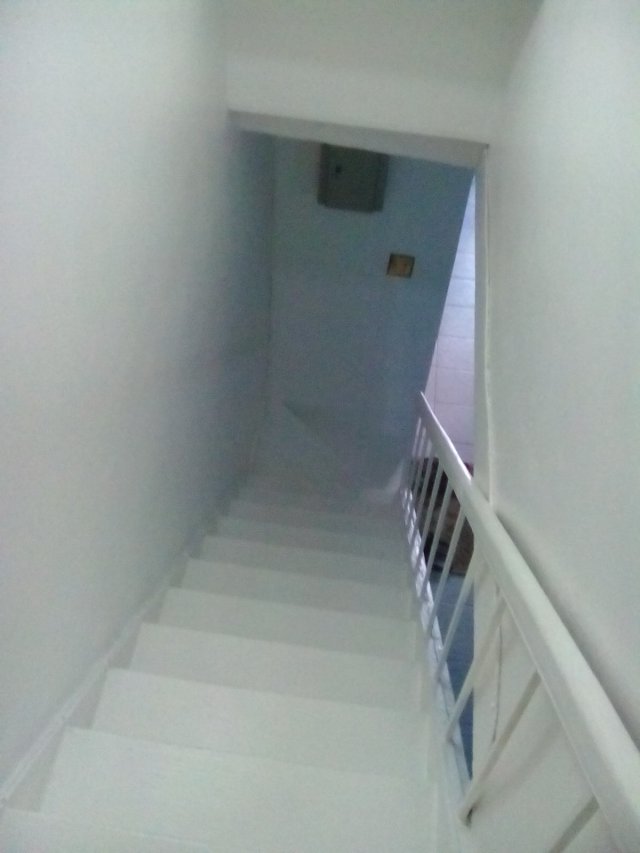
Find the location of a particular element. balustrades is located at coordinates (585, 811), (518, 700), (484, 636), (460, 601), (448, 558), (434, 525), (431, 498), (424, 488), (418, 477), (416, 453).